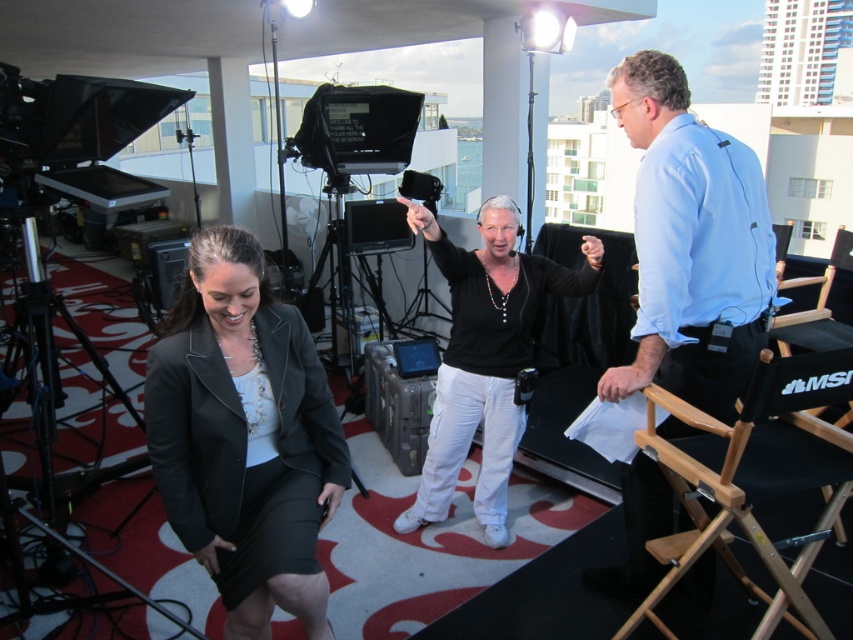
Question: Which of the following is the farthest from the observer?

Choices:
 (A) (170, 476)
 (B) (492, 508)
 (C) (637, 115)

Answer: (B)

Question: Which of the following is the farthest from the observer?

Choices:
 (A) matte black blazer at center
 (B) black matte shirt at center
 (C) blue shirt at right

Answer: (B)

Question: Which point is closer to the camera?

Choices:
 (A) matte black blazer at center
 (B) blue shirt at right

Answer: (A)

Question: In this image, where is matte black blazer at center located relative to blue shirt at right?

Choices:
 (A) right
 (B) left

Answer: (B)

Question: In this image, where is matte black blazer at center located relative to black matte shirt at center?

Choices:
 (A) right
 (B) left

Answer: (B)

Question: In this image, where is matte black blazer at center located relative to blue shirt at right?

Choices:
 (A) right
 (B) left

Answer: (B)